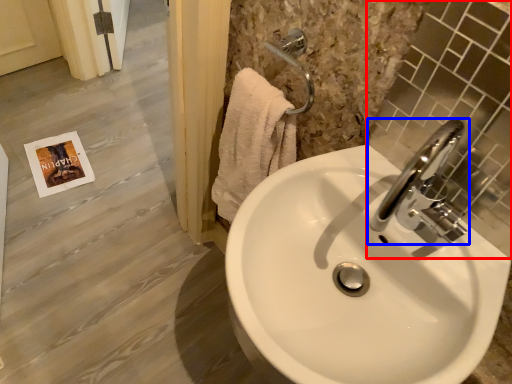
Question: Which point is closer to the camera, mirror (highlighted by a red box) or tap (highlighted by a blue box)?

Choices:
 (A) mirror
 (B) tap

Answer: (A)